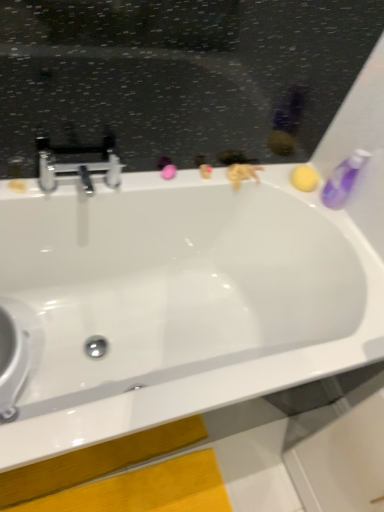
What are the coordinates of `polished chrome faucet at upper left` in the screenshot? It's located at (78, 164).

At what (x,y) coordinates should I click in order to perform the action: click on purple translucent bottle at upper right. Please return your answer as a coordinate pair (x, y). The width and height of the screenshot is (384, 512). Looking at the image, I should click on (343, 179).

This screenshot has width=384, height=512. I want to click on polished chrome faucet at upper left, so click(78, 164).

From the image's perspective, is white glossy bathtub at center above or below purple translucent bottle at upper right?

white glossy bathtub at center is situated lower than purple translucent bottle at upper right in the image.

Is the depth of white glossy bathtub at center less than that of purple translucent bottle at upper right?

Yes, it is in front of purple translucent bottle at upper right.

From a real-world perspective, which object stands above the other?

purple translucent bottle at upper right is physically above.

In the scene shown: Is polished chrome faucet at upper left situated inside white glossy bathtub at center or outside?

polished chrome faucet at upper left is not inside white glossy bathtub at center, it's outside.

How many degrees apart are the facing directions of polished chrome faucet at upper left and white glossy bathtub at center?

The angular difference between polished chrome faucet at upper left and white glossy bathtub at center is 0.000751 degrees.

Visually, is polished chrome faucet at upper left positioned to the left or to the right of white glossy bathtub at center?

Clearly, polished chrome faucet at upper left is on the left of white glossy bathtub at center in the image.

Does polished chrome faucet at upper left turn towards white glossy bathtub at center?

No, polished chrome faucet at upper left is not oriented towards white glossy bathtub at center.

Which is closer to the camera, (x=337, y=172) or (x=38, y=169)?

Clearly, point (x=337, y=172) is more distant from the camera than point (x=38, y=169).

From the picture: Which is in front, purple translucent bottle at upper right or polished chrome faucet at upper left?

polished chrome faucet at upper left is in front.

Considering the sizes of objects purple translucent bottle at upper right and polished chrome faucet at upper left in the image provided, who is wider, purple translucent bottle at upper right or polished chrome faucet at upper left?

purple translucent bottle at upper right is wider.

In terms of height, does purple translucent bottle at upper right look taller or shorter compared to polished chrome faucet at upper left?

purple translucent bottle at upper right is taller than polished chrome faucet at upper left.

From the image's perspective, which one is positioned lower, white glossy bathtub at center or polished chrome faucet at upper left?

white glossy bathtub at center.

Does white glossy bathtub at center have a lesser width compared to polished chrome faucet at upper left?

No, white glossy bathtub at center is not thinner than polished chrome faucet at upper left.

Is white glossy bathtub at center far away from polished chrome faucet at upper left?

white glossy bathtub at center is near polished chrome faucet at upper left, not far away.

Is white glossy bathtub at center positioned beyond the bounds of polished chrome faucet at upper left?

Yes, white glossy bathtub at center is not within polished chrome faucet at upper left.

Would you say purple translucent bottle at upper right is a long distance from white glossy bathtub at center?

No.

Is point (327, 205) closer to viewer compared to point (41, 338)?

No, (327, 205) is further to viewer.

Does purple translucent bottle at upper right have a lesser width compared to white glossy bathtub at center?

Correct, the width of purple translucent bottle at upper right is less than that of white glossy bathtub at center.

From the image's perspective, is purple translucent bottle at upper right on white glossy bathtub at center?

Yes, from the image's perspective, purple translucent bottle at upper right is over white glossy bathtub at center.

From a real-world perspective, which object stands above the other?

purple translucent bottle at upper right, from a real-world perspective.

Does polished chrome faucet at upper left come in front of purple translucent bottle at upper right?

Yes, polished chrome faucet at upper left is in front of purple translucent bottle at upper right.

What's the angular difference between polished chrome faucet at upper left and purple translucent bottle at upper right's facing directions?

The facing directions of polished chrome faucet at upper left and purple translucent bottle at upper right are 90 degrees apart.

Is polished chrome faucet at upper left with purple translucent bottle at upper right?

No, polished chrome faucet at upper left is not beside purple translucent bottle at upper right.

The width and height of the screenshot is (384, 512). What are the coordinates of `bathtub lying below the purple translucent bottle at upper right (from the image's perspective)` in the screenshot? It's located at (177, 301).

The height and width of the screenshot is (512, 384). I want to click on tap behind the white glossy bathtub at center, so click(x=78, y=164).

Considering their positions, is purple translucent bottle at upper right positioned further to polished chrome faucet at upper left than white glossy bathtub at center?

The object further to polished chrome faucet at upper left is purple translucent bottle at upper right.

Considering their positions, is white glossy bathtub at center positioned further to polished chrome faucet at upper left than purple translucent bottle at upper right?

Among the two, purple translucent bottle at upper right is located further to polished chrome faucet at upper left.

Estimate the real-world distances between objects in this image. Which object is further from purple translucent bottle at upper right, polished chrome faucet at upper left or white glossy bathtub at center?

The object further to purple translucent bottle at upper right is polished chrome faucet at upper left.

From the image, which object appears to be farther from white glossy bathtub at center, purple translucent bottle at upper right or polished chrome faucet at upper left?

purple translucent bottle at upper right lies further to white glossy bathtub at center than the other object.

Based on their spatial positions, is polished chrome faucet at upper left or purple translucent bottle at upper right further from white glossy bathtub at center?

→ purple translucent bottle at upper right.

From the image, which object appears to be farther from purple translucent bottle at upper right, white glossy bathtub at center or polished chrome faucet at upper left?

The object further to purple translucent bottle at upper right is polished chrome faucet at upper left.

Image resolution: width=384 pixels, height=512 pixels. What are the coordinates of `bathtub located between polished chrome faucet at upper left and purple translucent bottle at upper right in the left-right direction` in the screenshot? It's located at (177, 301).